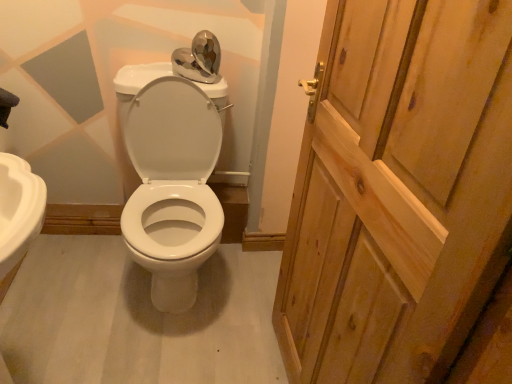
Question: Based on their sizes in the image, would you say white glossy toilet at center is bigger or smaller than wooden door at right?

Choices:
 (A) big
 (B) small

Answer: (A)

Question: Visually, is white glossy toilet at center positioned to the left or to the right of wooden door at right?

Choices:
 (A) left
 (B) right

Answer: (A)

Question: Is white glossy toilet at center inside or outside of wooden door at right?

Choices:
 (A) inside
 (B) outside

Answer: (B)

Question: Considering the positions of wooden door at right and white glossy toilet at center in the image, is wooden door at right wider or thinner than white glossy toilet at center?

Choices:
 (A) thin
 (B) wide

Answer: (A)

Question: Is wooden door at right taller or shorter than white glossy toilet at center?

Choices:
 (A) tall
 (B) short

Answer: (A)

Question: In terms of size, does wooden door at right appear bigger or smaller than white glossy toilet at center?

Choices:
 (A) big
 (B) small

Answer: (B)

Question: From the image's perspective, is wooden door at right located above or below white glossy toilet at center?

Choices:
 (A) above
 (B) below

Answer: (B)